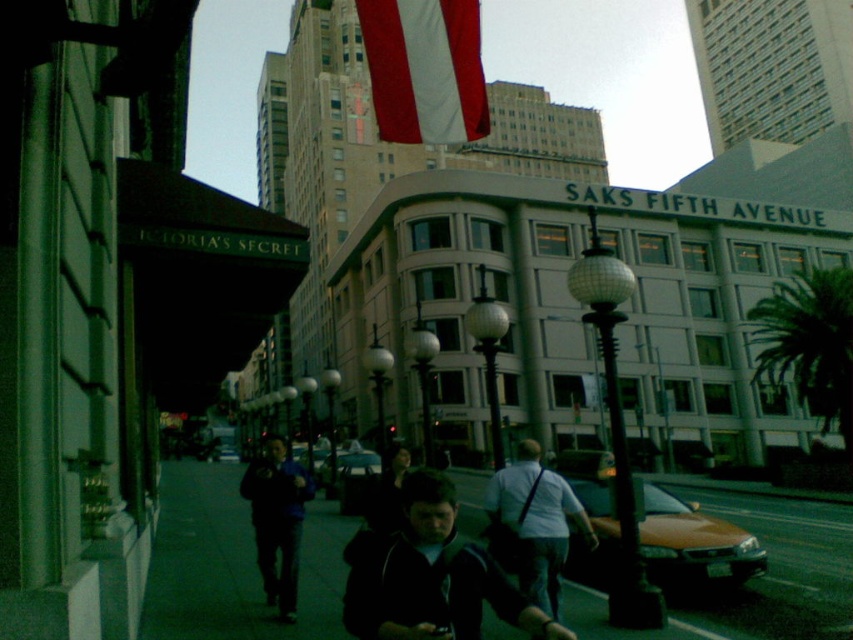
You are a delivery drone flying at an altitude of 10 feet. You need to land on the dark gray asphalt at lower center to deliver a package. However, there is a person wearing light blue jeans at center standing nearby. According to the objects description, what is the minimum horizontal distance you should maintain between your landing spot and the person to ensure safety?

The dark gray asphalt at lower center is 34.63 feet away from light blue jeans at center. To ensure safety, the drone should maintain a minimum horizontal distance of at least 34.63 feet between the landing spot and the person wearing light blue jeans at center.

You are a photographer trying to capture a candid shot of the two people on the sidewalk. The light blue jeans at center and the blue fabric jacket at center are both in your frame. Since you want to focus on the person with the larger clothing item, which one should you aim your camera at?

The light blue jeans at center is larger in size than the blue fabric jacket at center, so you should aim your camera at the light blue jeans at center to focus on the larger clothing item.